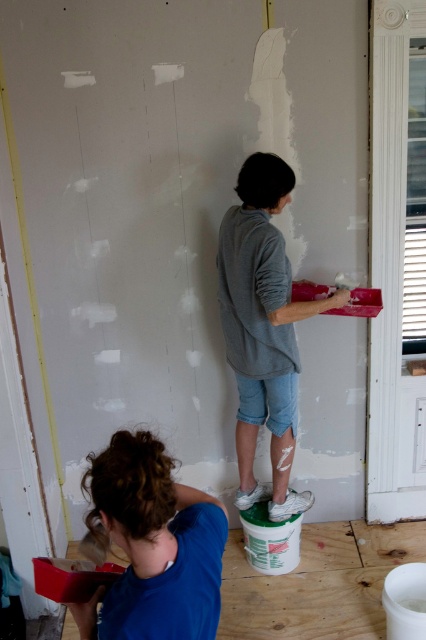
Consider the image. You are standing at the entrance of the room and see two points marked on the wall. Which point, point (112,492) or point (233,289), is closer to you?

Point (112,492) is in front of point (233,289), so it is closer to you.

Based on the scene description, where is the blue fabric shirt at lower left located in terms of its 2D coordinates?

The blue fabric shirt at lower left is located at the 2D coordinates of point (154, 545).

Looking at this image, you are a contractor assessing the workspace. You notice the blue fabric shirt at lower left and the gray cotton shirt at center. Which person is shorter in height?

The blue fabric shirt at lower left is shorter than the gray cotton shirt at center, so the person wearing the blue fabric shirt at lower left is shorter.